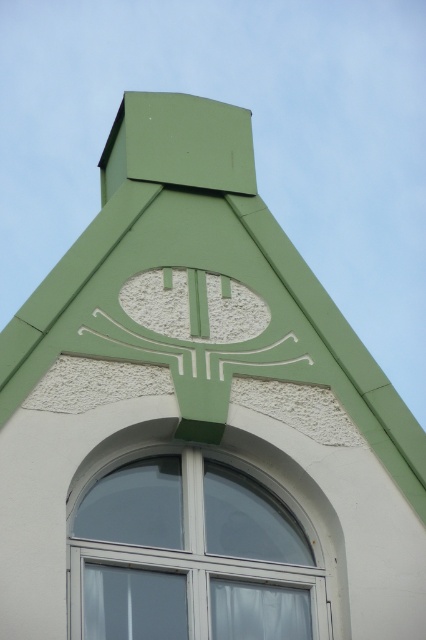
You are standing at the base of the building and want to take a photo of the green matte roof at center. If your camera has a maximum focus range of 45 meters, will you be able to capture the roof clearly?

The green matte roof at center is 46.43 meters away from the camera. Since the camera can only focus up to 45 meters, you won cannot capture the roof clearly within the current distance.

You are an architect examining the building facade. You notice the green matte roof at center and the white plastic window at center. Which object has a greater width?

The green matte roof at center has a greater width than the white plastic window at center.

You are an architect reviewing a building facade design. You notice the green matte roof at center and the white plastic window at center. According to the design, which object is positioned to the right side?

The white plastic window at center is positioned to the right of the green matte roof at center.